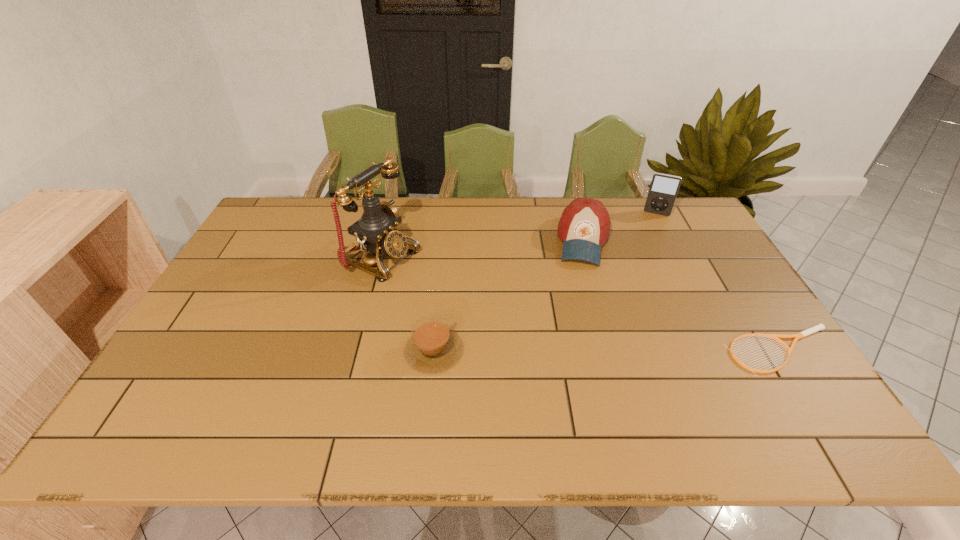
You are a GUI agent. You are given a task and a screenshot of the screen. Output one action in this format:
    pyautogui.click(x=<x>, y=<y>)
    Task: Click on the cappuccino that is at the near edge
    
    Given the screenshot: What is the action you would take?
    pyautogui.click(x=432, y=346)

The height and width of the screenshot is (540, 960). I want to click on tennis racket located in the near edge section of the desktop, so click(x=819, y=327).

You are a GUI agent. You are given a task and a screenshot of the screen. Output one action in this format:
    pyautogui.click(x=<x>, y=<y>)
    Task: Click on the tennis racket that is at the right edge
    This screenshot has height=540, width=960.
    Given the screenshot: What is the action you would take?
    pyautogui.click(x=819, y=327)

You are a GUI agent. You are given a task and a screenshot of the screen. Output one action in this format:
    pyautogui.click(x=<x>, y=<y>)
    Task: Click on the iPod at the right edge
    Image resolution: width=960 pixels, height=540 pixels.
    Given the screenshot: What is the action you would take?
    pyautogui.click(x=664, y=188)

At what (x,y) coordinates should I click in order to perform the action: click on object located at the far right corner. Please return your answer as a coordinate pair (x, y). This screenshot has width=960, height=540. Looking at the image, I should click on (664, 188).

Where is `object present at the near right corner`? This screenshot has width=960, height=540. object present at the near right corner is located at coordinates (819, 327).

Where is `blank space at the far edge of the desktop`? The image size is (960, 540). blank space at the far edge of the desktop is located at coordinates 492,224.

Where is `vacant space at the near edge`? vacant space at the near edge is located at coordinates (372, 390).

Find the location of a particular element. vacant space at the left edge is located at coordinates (252, 289).

Identify the location of vacant space at the right edge of the desktop. (678, 255).